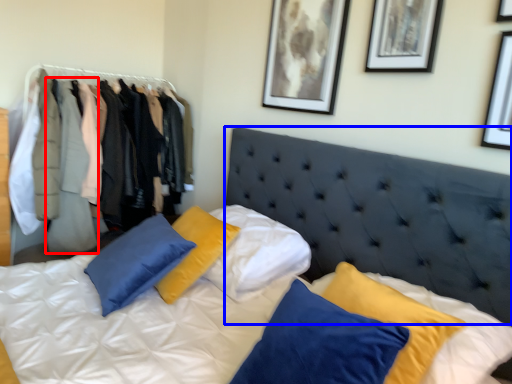
Question: Which point is closer to the camera, clothing (highlighted by a red box) or headboard (highlighted by a blue box)?

Choices:
 (A) clothing
 (B) headboard

Answer: (B)